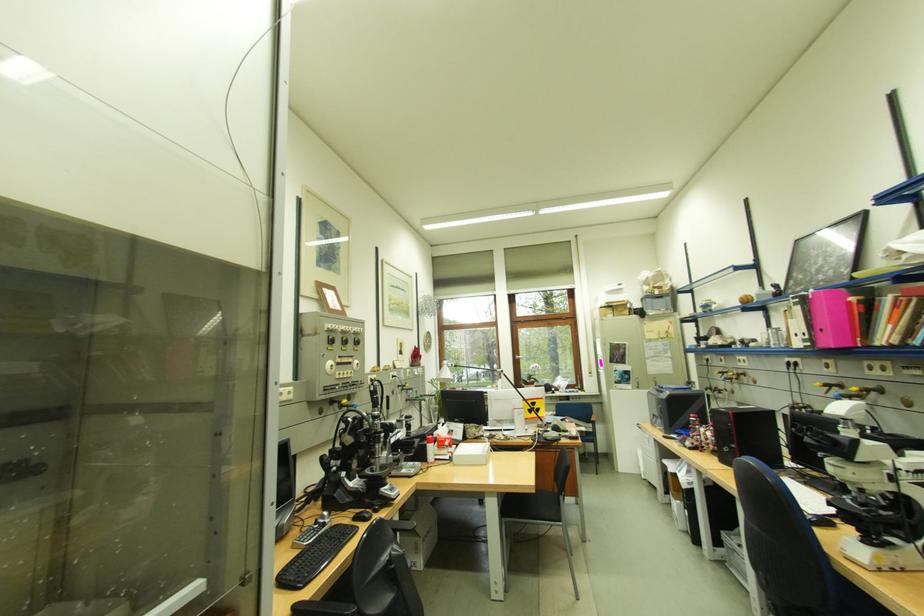
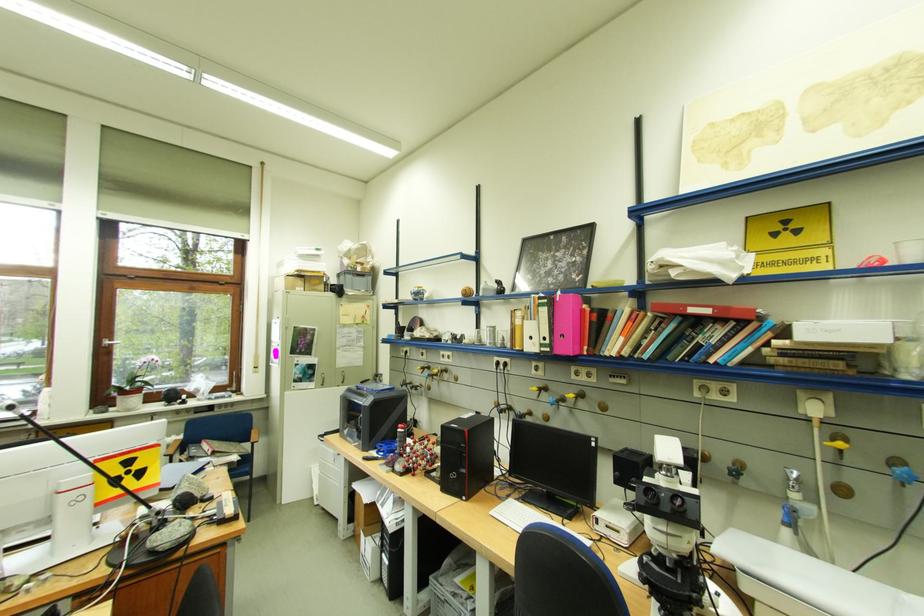
Locate, in the second image, the point that corresponds to the point at 735,371 in the first image.

(435, 367)